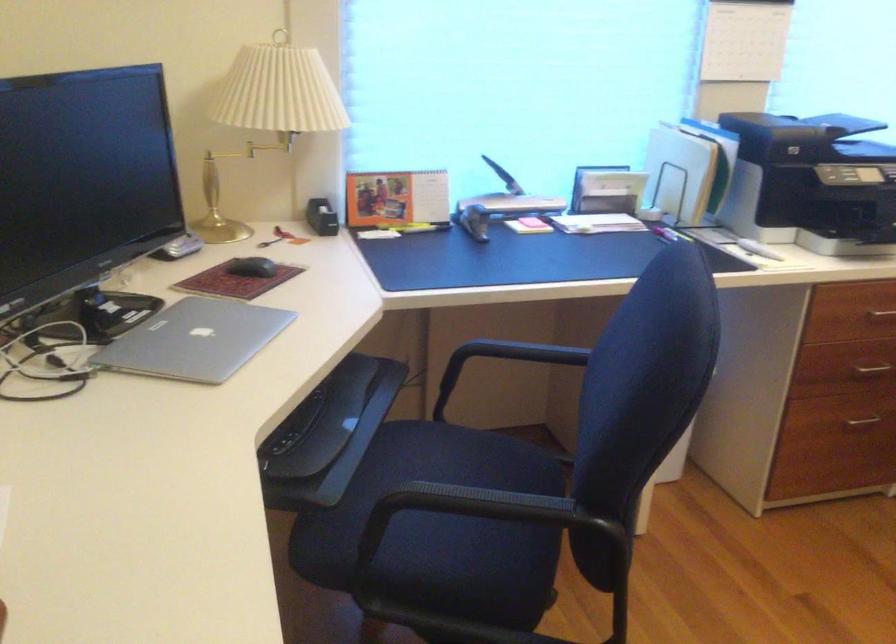
Find where to click the black computer mouse. Please return your answer as a coordinate pair (x, y).

(252, 267)